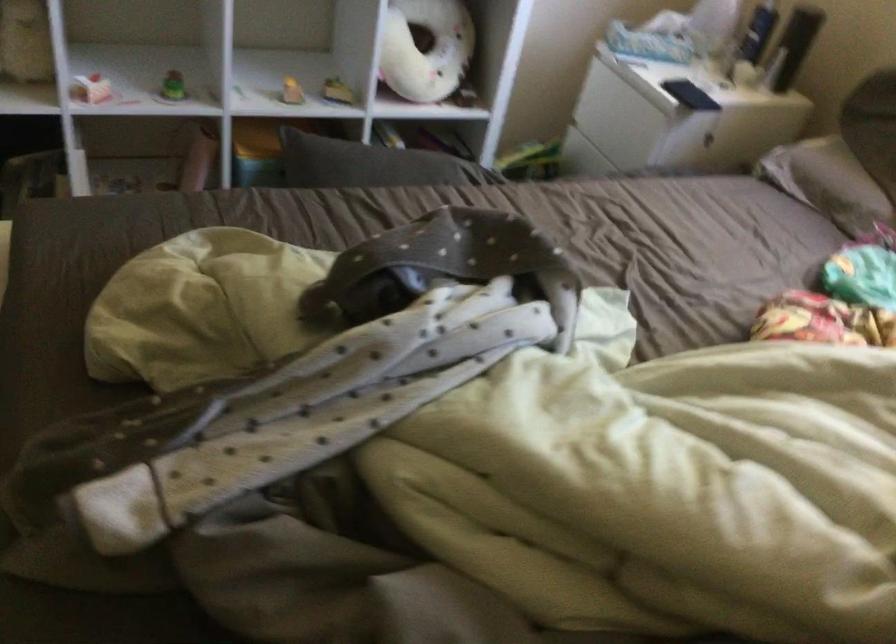
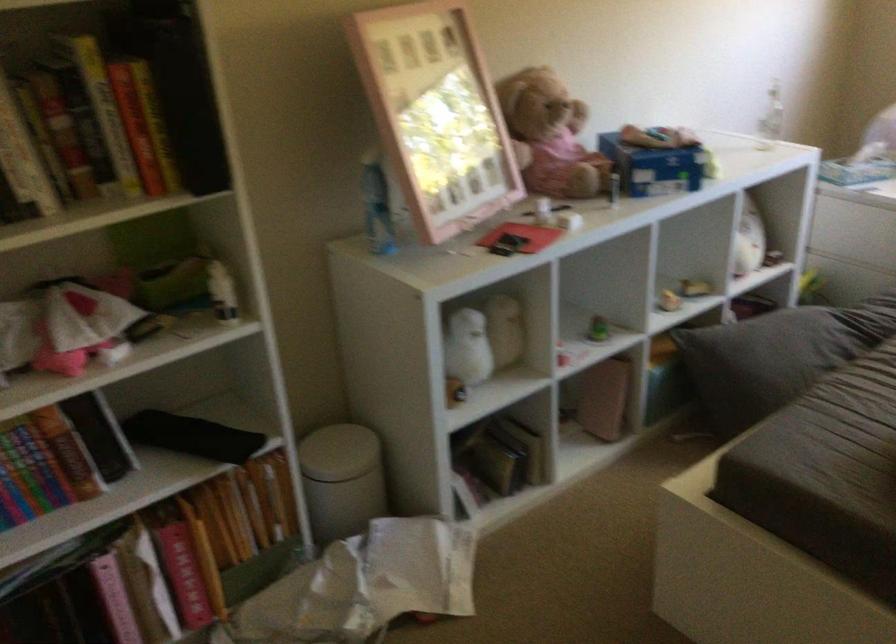
Question: In a continuous first-person perspective shot, in which direction is the camera moving?

Choices:
 (A) Left
 (B) Right
 (C) Forward
 (D) Backward

Answer: (A)